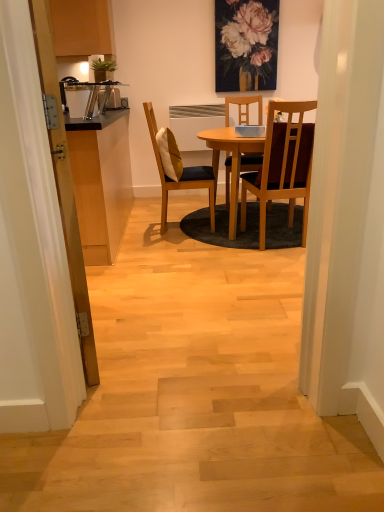
Locate an element on the screen. The width and height of the screenshot is (384, 512). vacant area that is situated to the right of wooden door at left is located at coordinates (170, 324).